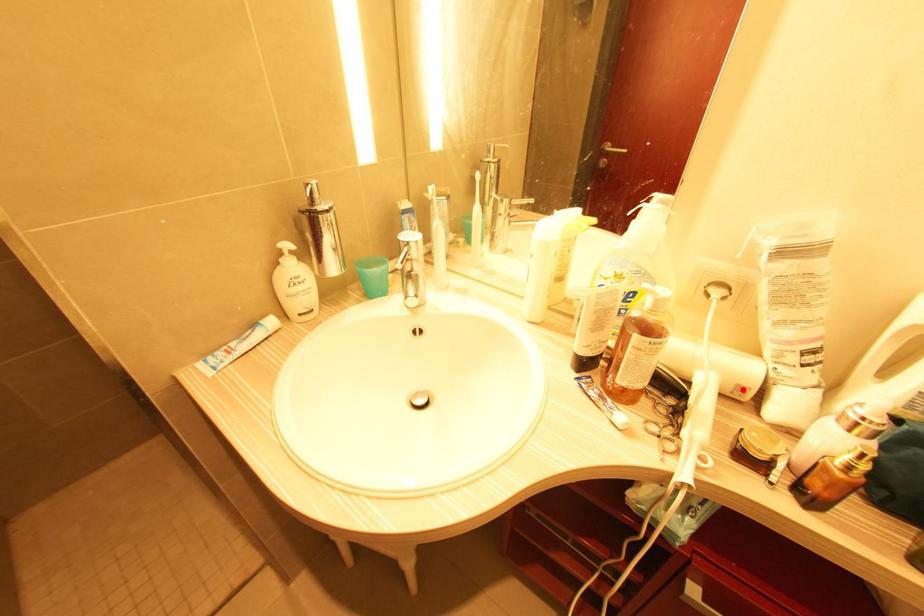
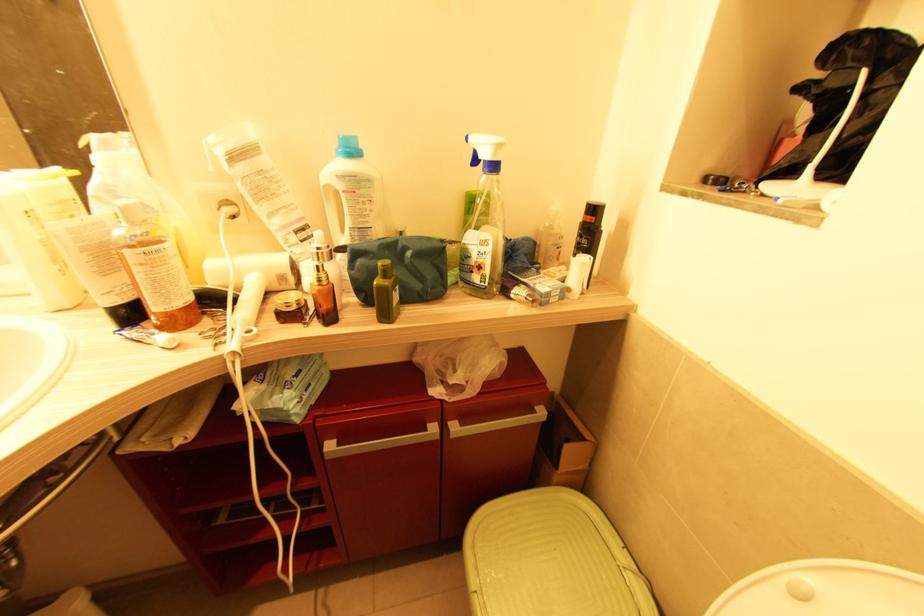
In the second image, find the point that corresponds to the highlighted location in the first image.

(284, 278)